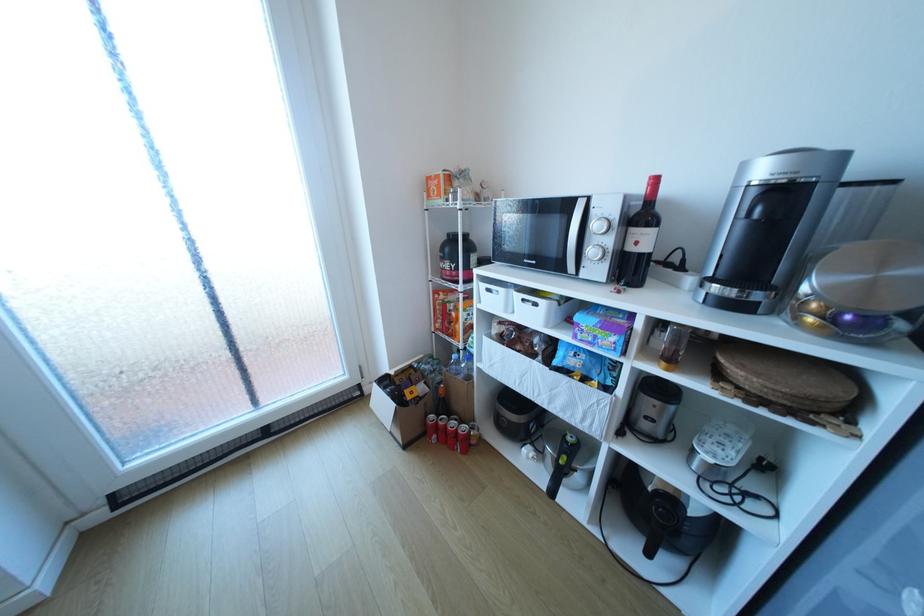
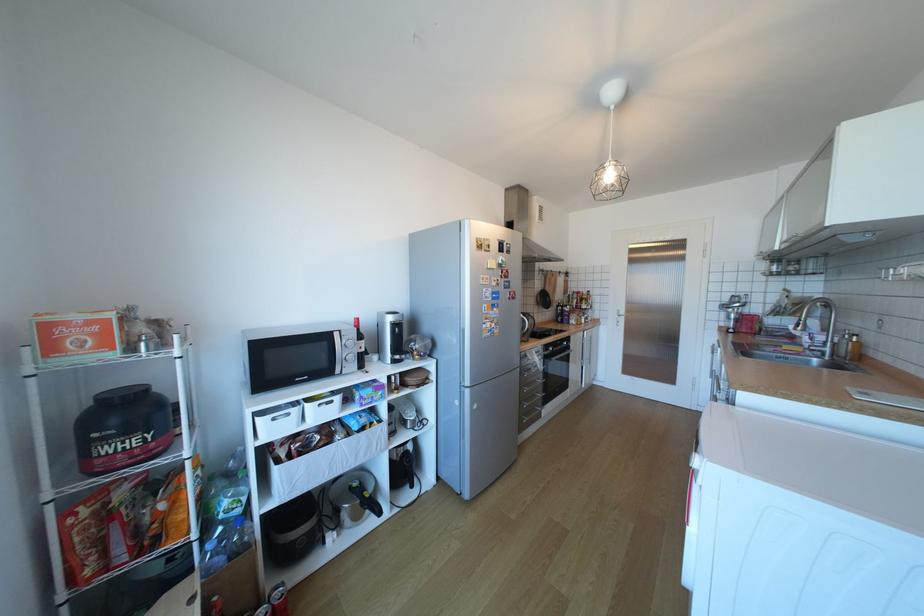
Find the pixel in the second image that matches point 466,429 in the first image.

(283, 607)